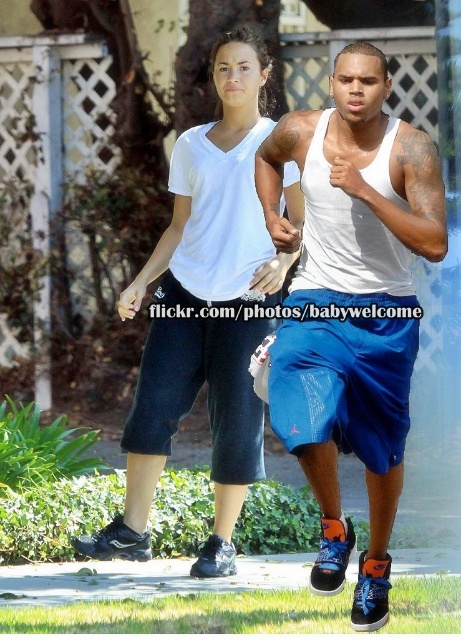
You are a photographer trying to capture a photo of the blue fabric shorts at center and the black synthetic running shoe at lower left. If you want to frame both subjects in the same shot, which direction should you move your camera to ensure both are visible?

Since the blue fabric shorts at center is to the right of the black synthetic running shoe at lower left, you should move your camera slightly to the left to include both subjects in the frame.

You are a fashion designer analyzing the image. Which object is bigger between the blue fabric shorts at center and the black synthetic running shoe at lower left?

The blue fabric shorts at center has a larger size compared to the black synthetic running shoe at lower left.